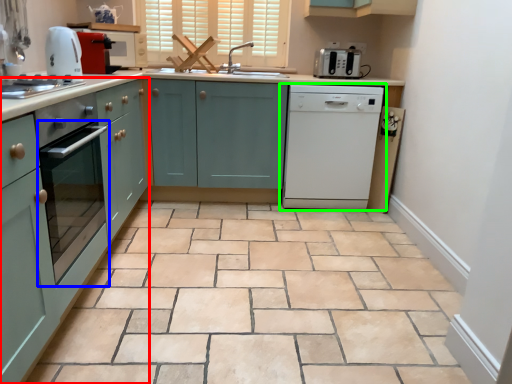
Question: Which object is the closest to the cabinetry (highlighted by a red box)? Choose among these: oven (highlighted by a blue box) or home appliance (highlighted by a green box).

Choices:
 (A) oven
 (B) home appliance

Answer: (A)